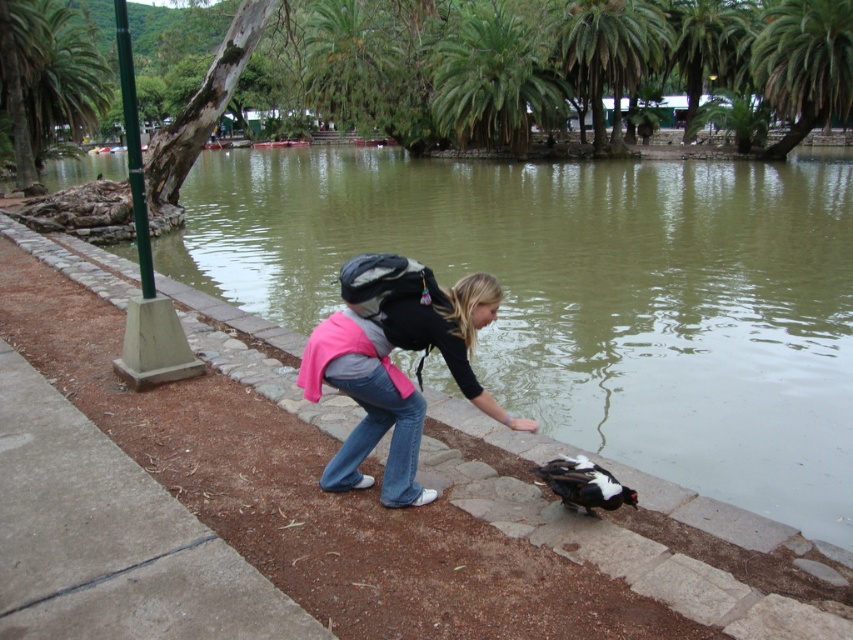
Does greenish water at center have a lesser height compared to pink fabric backpack at center?

In fact, greenish water at center may be taller than pink fabric backpack at center.

Does greenish water at center have a greater width compared to pink fabric backpack at center?

Yes.

The height and width of the screenshot is (640, 853). In order to click on greenish water at center in this screenshot , I will do `click(587, 294)`.